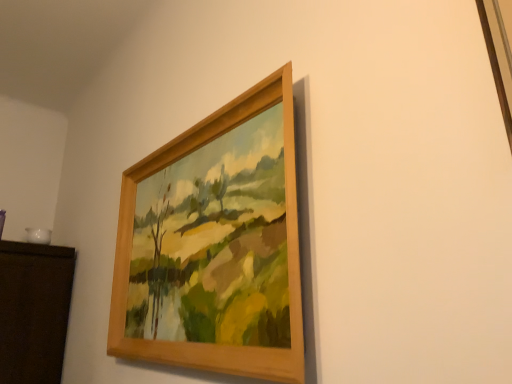
The height and width of the screenshot is (384, 512). What do you see at coordinates (215, 245) in the screenshot?
I see `wooden frame at upper center` at bounding box center [215, 245].

Where is `wooden frame at upper center`? The width and height of the screenshot is (512, 384). wooden frame at upper center is located at coordinates (215, 245).

The image size is (512, 384). I want to click on wooden frame at upper center, so click(x=215, y=245).